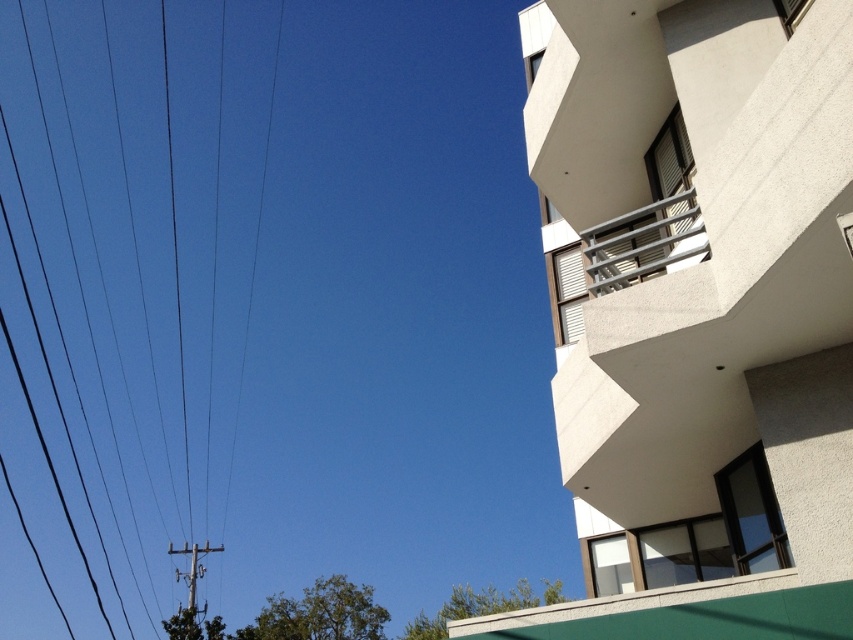
Question: Which point is farther to the camera?

Choices:
 (A) metallic gray pole at lower left
 (B) black wire at left
 (C) metallic gray balcony at upper right

Answer: (B)

Question: Among these objects, which one is nearest to the camera?

Choices:
 (A) metallic gray balcony at upper right
 (B) black wire at left
 (C) metallic gray pole at lower left

Answer: (A)

Question: Among these points, which one is farthest from the camera?

Choices:
 (A) (224, 492)
 (B) (173, 550)
 (C) (631, 236)

Answer: (A)

Question: Is the position of black wire at left more distant than that of metallic gray balcony at upper right?

Choices:
 (A) yes
 (B) no

Answer: (A)

Question: Does black wire at left appear under metallic gray balcony at upper right?

Choices:
 (A) yes
 (B) no

Answer: (B)

Question: Can you confirm if black wire at left is positioned below metallic gray pole at lower left?

Choices:
 (A) yes
 (B) no

Answer: (B)